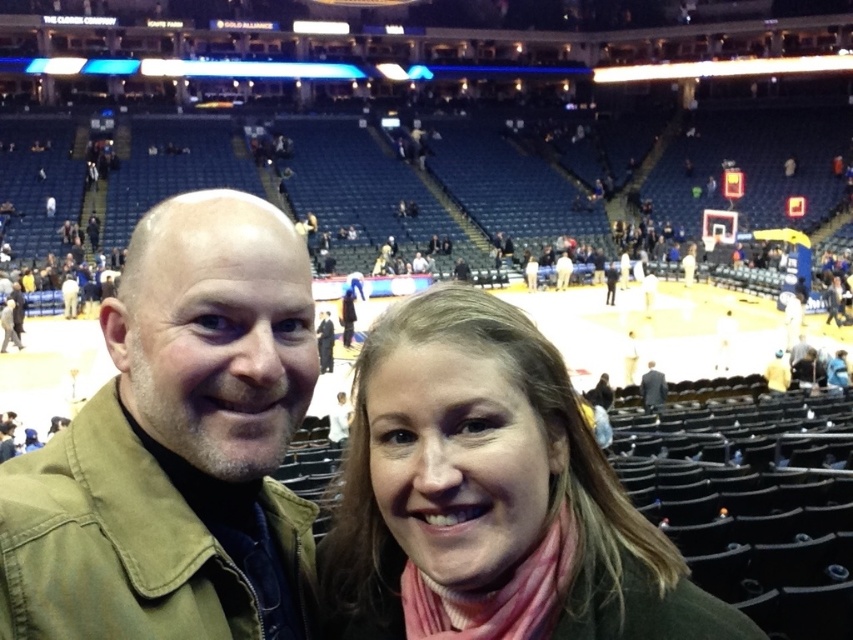
Question: Which object is closer to the camera taking this photo?

Choices:
 (A) dark gray suit at center
 (B) pink wool scarf at center
 (C) khaki cotton jacket at left

Answer: (B)

Question: Estimate the real-world distances between objects in this image. Which object is farther from the dark gray suit at center?

Choices:
 (A) khaki cotton jacket at left
 (B) pink wool scarf at center

Answer: (A)

Question: Is khaki cotton jacket at left to the right of pink wool scarf at center from the viewer's perspective?

Choices:
 (A) yes
 (B) no

Answer: (B)

Question: Based on their relative distances, which object is nearer to the khaki cotton jacket at left?

Choices:
 (A) dark gray suit at center
 (B) pink wool scarf at center

Answer: (B)

Question: Observing the image, what is the correct spatial positioning of pink wool scarf at center in reference to dark gray suit at center?

Choices:
 (A) left
 (B) right

Answer: (A)

Question: Does pink wool scarf at center have a lesser width compared to dark gray suit at center?

Choices:
 (A) no
 (B) yes

Answer: (A)